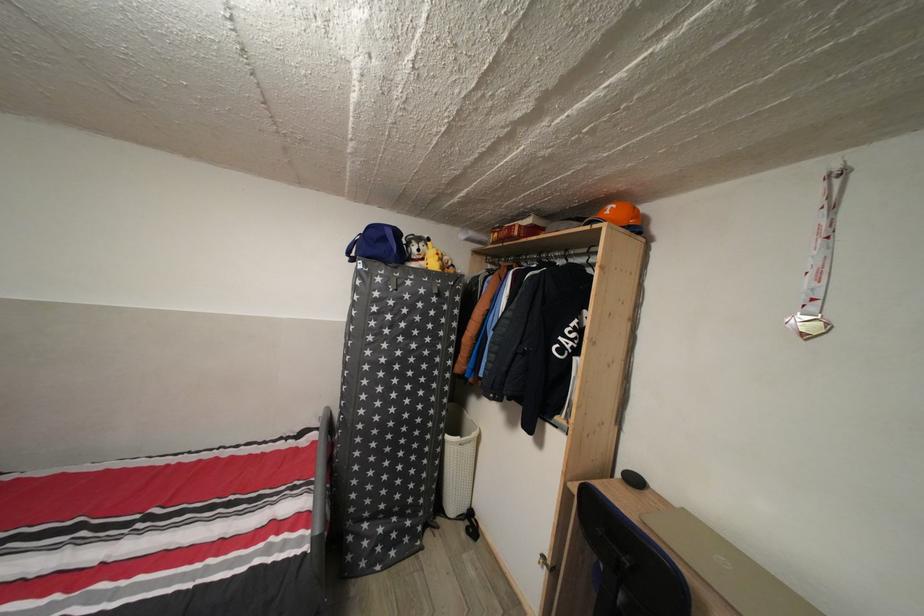
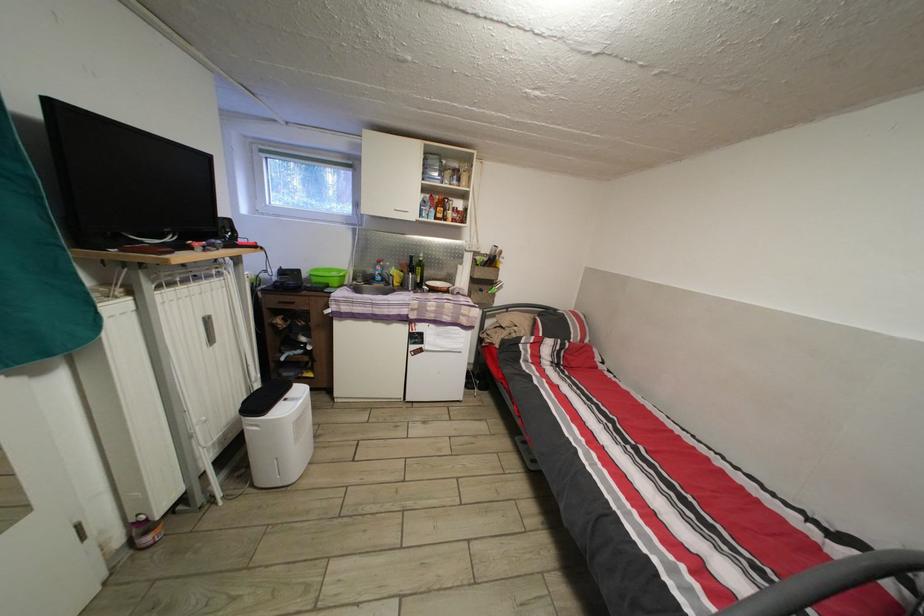
Question: The camera is either moving clockwise (left) or counter-clockwise (right) around the object. The first image is from the beginning of the video and the second image is from the end. Is the camera moving left or right when shooting the video?

Choices:
 (A) Left
 (B) Right

Answer: (B)